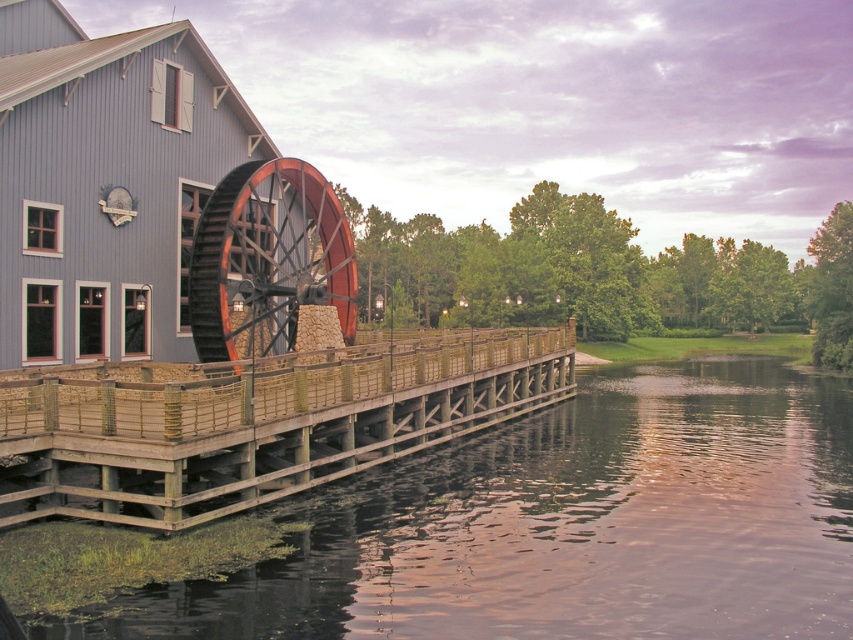
Which is below, smooth dark water at center or wooden waterwheel at center?

smooth dark water at center is below.

I want to click on smooth dark water at center, so click(564, 525).

Can you confirm if smooth dark water at center is thinner than wooden dock at lower left?

No, smooth dark water at center is not thinner than wooden dock at lower left.

What are the coordinates of `smooth dark water at center` in the screenshot? It's located at (564, 525).

Where is `smooth dark water at center`? smooth dark water at center is located at coordinates tap(564, 525).

In the scene shown: Is wooden dock at lower left above wooden waterwheel at center?

→ Incorrect, wooden dock at lower left is not positioned above wooden waterwheel at center.

Is point (282, 406) positioned behind point (219, 244)?

No, it is not.

You are a GUI agent. You are given a task and a screenshot of the screen. Output one action in this format:
    pyautogui.click(x=<x>, y=<y>)
    Task: Click on the wooden dock at lower left
    
    Given the screenshot: What is the action you would take?
    pyautogui.click(x=251, y=422)